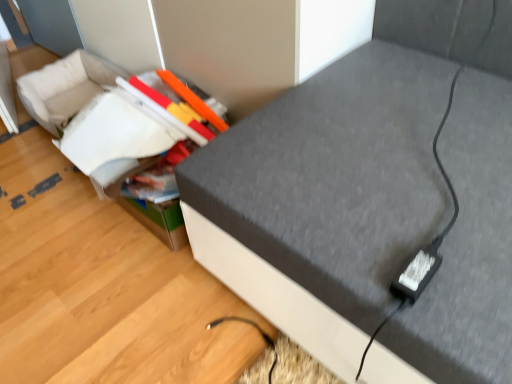
Looking at this image, what is the approximate height of textured gray sofa at center?

The height of textured gray sofa at center is 28.56 inches.

The width and height of the screenshot is (512, 384). Identify the location of black plastic plug at lower right. (417, 272).

Looking at this image, which object is more forward, textured gray sofa at center or matte plastic storage box at center?

Positioned in front is textured gray sofa at center.

From a real-world perspective, is textured gray sofa at center under matte plastic storage box at center?

No, from a real-world perspective, textured gray sofa at center is not below matte plastic storage box at center.

Is textured gray sofa at center inside or outside of matte plastic storage box at center?

textured gray sofa at center is not inside matte plastic storage box at center, it's outside.

Is textured gray sofa at center aimed at matte plastic storage box at center?

No, textured gray sofa at center is not aimed at matte plastic storage box at center.

Is matte plastic storage box at center looking in the opposite direction of black plastic plug at lower right?

matte plastic storage box at center does not have its back to black plastic plug at lower right.

Is matte plastic storage box at center surrounding black plastic plug at lower right?

No, black plastic plug at lower right is not surrounded by matte plastic storage box at center.

Is matte plastic storage box at center to the left of black plastic plug at lower right from the viewer's perspective?

Indeed, matte plastic storage box at center is positioned on the left side of black plastic plug at lower right.

From a real-world perspective, who is located higher, matte plastic storage box at center or black plastic plug at lower right?

black plastic plug at lower right, from a real-world perspective.

From the image's perspective, would you say matte plastic storage box at center is shown under textured gray sofa at center?

Yes, from the image's perspective, matte plastic storage box at center is below textured gray sofa at center.

Which point is more forward, [179,216] or [397,324]?

The point [397,324] is in front.

Is matte plastic storage box at center facing away from textured gray sofa at center?

No.

Based on the photo, considering the positions of objects matte plastic storage box at center and textured gray sofa at center in the image provided, who is more to the left, matte plastic storage box at center or textured gray sofa at center?

matte plastic storage box at center.

Does point (414, 294) appear closer or farther from the camera than point (422, 193)?

Clearly, point (414, 294) is closer to the camera than point (422, 193).

Consider the image. Which object is more forward, black plastic plug at lower right or textured gray sofa at center?

Positioned in front is textured gray sofa at center.

From a real-world perspective, which object rests below the other?

textured gray sofa at center, from a real-world perspective.

Based on the photo, between black plastic plug at lower right and textured gray sofa at center, which one has smaller width?

Thinner between the two is black plastic plug at lower right.

Which of these two, black plastic plug at lower right or matte plastic storage box at center, is thinner?

Thinner between the two is black plastic plug at lower right.

Is black plastic plug at lower right positioned with its back to matte plastic storage box at center?

black plastic plug at lower right does not have its back to matte plastic storage box at center.

Consider the image. Considering the positions of objects black plastic plug at lower right and matte plastic storage box at center in the image provided, who is more to the left, black plastic plug at lower right or matte plastic storage box at center?

matte plastic storage box at center.

From a real-world perspective, who is located higher, black plastic plug at lower right or matte plastic storage box at center?

black plastic plug at lower right.

From the image's perspective, is textured gray sofa at center under black plastic plug at lower right?

No, from the image's perspective, textured gray sofa at center is not beneath black plastic plug at lower right.

Which is nearer, (476, 262) or (441, 239)?

The point (476, 262) is more forward.

At what (x,y) coordinates should I click in order to perform the action: click on plug above the textured gray sofa at center (from a real-world perspective). Please return your answer as a coordinate pair (x, y). Looking at the image, I should click on (417, 272).

Considering the sizes of textured gray sofa at center and black plastic plug at lower right in the image, is textured gray sofa at center taller or shorter than black plastic plug at lower right?

Clearly, textured gray sofa at center is taller compared to black plastic plug at lower right.

The width and height of the screenshot is (512, 384). Find the location of `storage box on the left of textured gray sofa at center`. storage box on the left of textured gray sofa at center is located at coordinates (152, 209).

Locate an element on the screen. Image resolution: width=512 pixels, height=384 pixels. plug lying on the right of matte plastic storage box at center is located at coordinates (417, 272).

Based on their spatial positions, is black plastic plug at lower right or matte plastic storage box at center closer to textured gray sofa at center?

black plastic plug at lower right.

Consider the image. When comparing their distances from black plastic plug at lower right, does matte plastic storage box at center or textured gray sofa at center seem further?

matte plastic storage box at center.

Based on their spatial positions, is matte plastic storage box at center or black plastic plug at lower right closer to textured gray sofa at center?

black plastic plug at lower right lies closer to textured gray sofa at center than the other object.

When comparing their distances from matte plastic storage box at center, does black plastic plug at lower right or textured gray sofa at center seem further?

black plastic plug at lower right lies further to matte plastic storage box at center than the other object.

Looking at the image, which one is located closer to black plastic plug at lower right, textured gray sofa at center or matte plastic storage box at center?

The object closer to black plastic plug at lower right is textured gray sofa at center.

Estimate the real-world distances between objects in this image. Which object is closer to matte plastic storage box at center, textured gray sofa at center or black plastic plug at lower right?

textured gray sofa at center.

The height and width of the screenshot is (384, 512). I want to click on plug between textured gray sofa at center and matte plastic storage box at center from front to back, so click(417, 272).